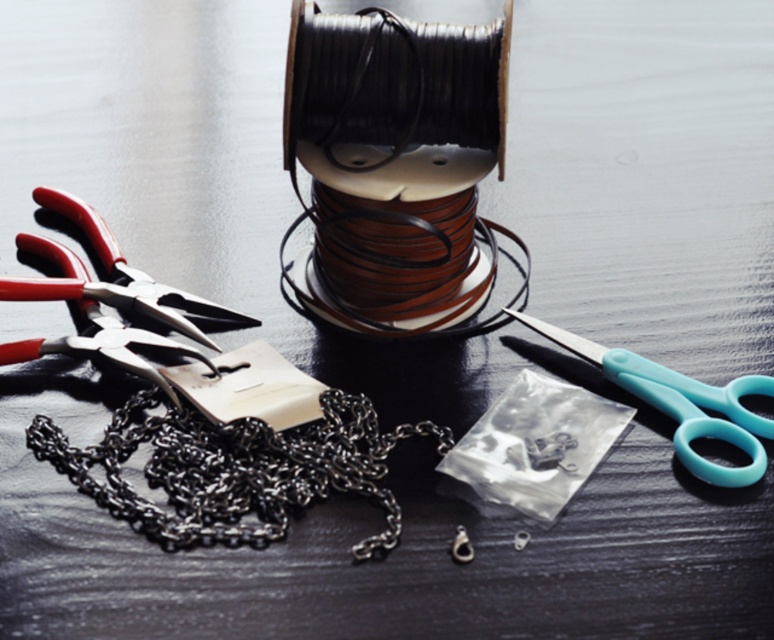
Does black metallic chain at center come in front of matte metal pliers at left?

Yes.

Is point (300, 438) in front of point (55, 189)?

Yes, it is.

Is point (228, 508) positioned before point (197, 307)?

Yes, it is in front of point (197, 307).

Locate an element on the screen. The width and height of the screenshot is (774, 640). black metallic chain at center is located at coordinates click(235, 468).

Based on the photo, does black metallic chain at center appear over teal plastic scissors at right?

No.

Between black metallic chain at center and teal plastic scissors at right, which one has more height?

teal plastic scissors at right is taller.

Find the location of `black metallic chain at center`. black metallic chain at center is located at coordinates (235, 468).

Does teal plastic scissors at right have a lesser width compared to matte metal pliers at left?

Indeed, teal plastic scissors at right has a lesser width compared to matte metal pliers at left.

Does teal plastic scissors at right appear over matte metal pliers at left?

No, teal plastic scissors at right is not above matte metal pliers at left.

What do you see at coordinates (680, 403) in the screenshot? I see `teal plastic scissors at right` at bounding box center [680, 403].

Where is `teal plastic scissors at right`? This screenshot has height=640, width=774. teal plastic scissors at right is located at coordinates (680, 403).